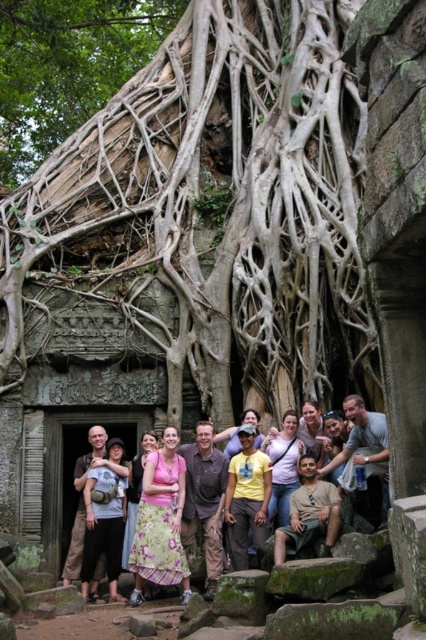
You are a photographer trying to capture a photo of the light pink fabric dress at center without including the brown textured roots at upper center. Based on their positions, is it possible to frame the shot so that the dress is visible but the roots are not?

The brown textured roots at upper center are to the left of the light pink fabric dress at center, so it is possible to frame the shot by positioning the camera to the right side of the dress, ensuring the roots are out of the frame.

You are standing in front of the ancient stone structure and notice a specific point marked at coordinates [68,67]. Based on the scene description, where is this point located?

The point at [68,67] is located on the brown textured roots at upper center.